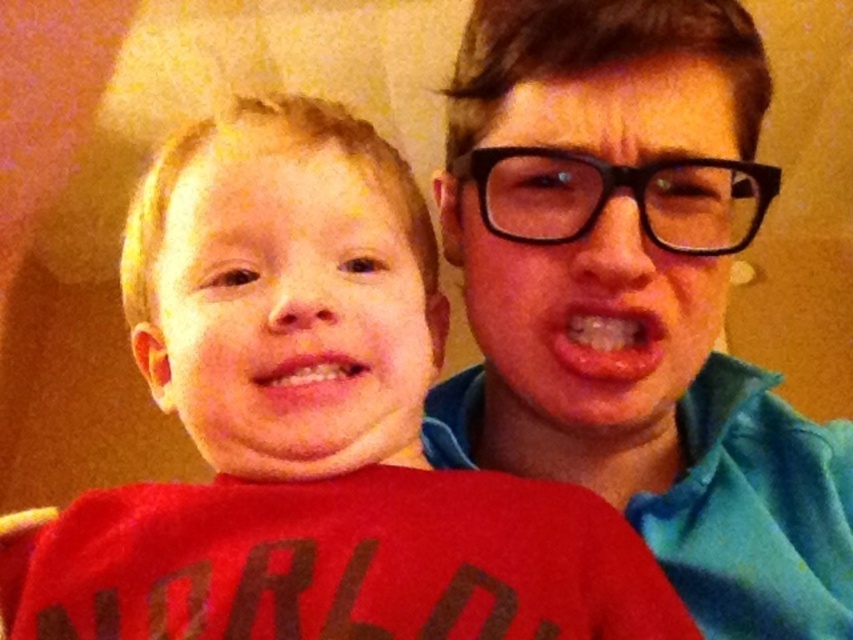
Can you confirm if black plastic glasses at upper right is bigger than glossy pink lips at center?

Yes, black plastic glasses at upper right is bigger than glossy pink lips at center.

Is black plastic glasses at upper right to the left of glossy pink lips at center from the viewer's perspective?

Correct, you'll find black plastic glasses at upper right to the left of glossy pink lips at center.

Does point (619, 305) come behind point (601, 355)?

That is False.

The image size is (853, 640). In order to click on black plastic glasses at upper right in this screenshot , I will do `click(583, 316)`.

Is black plastic glasses at upper right above pink glossy lips at center?

Yes, black plastic glasses at upper right is above pink glossy lips at center.

Image resolution: width=853 pixels, height=640 pixels. What do you see at coordinates (583, 316) in the screenshot? I see `black plastic glasses at upper right` at bounding box center [583, 316].

Is point (645, 118) farther from camera compared to point (316, 360)?

Yes, it is behind point (316, 360).

This screenshot has width=853, height=640. I want to click on black plastic glasses at upper right, so click(x=583, y=316).

Where is `red matte shirt at left`? This screenshot has width=853, height=640. red matte shirt at left is located at coordinates (310, 429).

Between point (137, 218) and point (238, 230), which one is positioned in front?

Point (238, 230) is in front.

You are a GUI agent. You are given a task and a screenshot of the screen. Output one action in this format:
    pyautogui.click(x=<x>, y=<y>)
    Task: Click on the red matte shirt at left
    The image size is (853, 640).
    Given the screenshot: What is the action you would take?
    pyautogui.click(x=310, y=429)